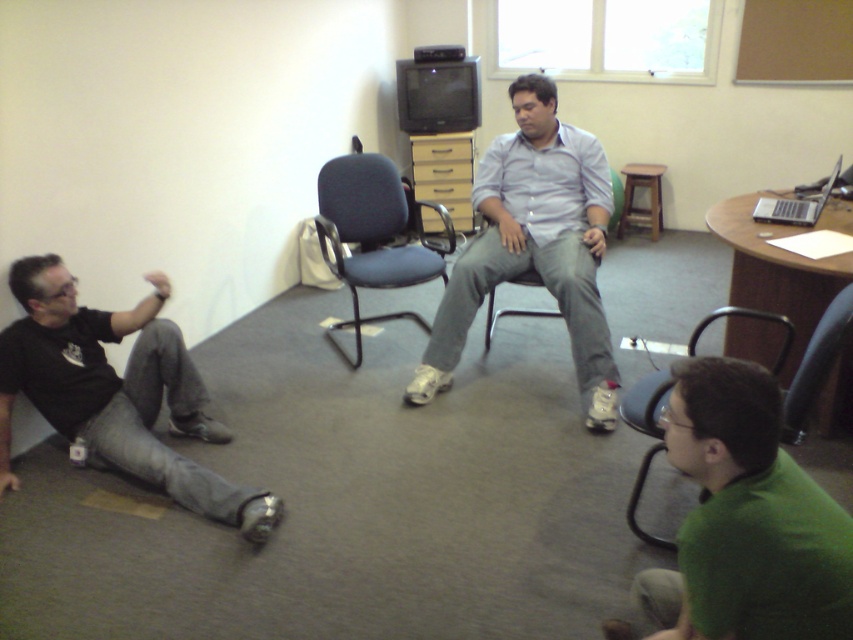
You are standing at the entrance of the room and want to greet the person in the black matte shirt at lower left and the person sitting on the matte blue chair at center. Which person should you approach first if you want to greet the one closer to the entrance?

The black matte shirt at lower left is to the left of the matte blue chair at center, so the black matte shirt at lower left is closer to the entrance. You should approach the black matte shirt at lower left first.

You are a delivery robot with a package that needs to be placed between the green matte shirt at lower right and the light blue shirt at center. The package requires a minimum of 1.6 meters of space. Is the distance sufficient?

The distance between the green matte shirt at lower right and the light blue shirt at center is 1.55 meters, which is less than the required 1.6 meters. Therefore, the space is insufficient for placing the package.

You are organizing a photo shoot and need to place two models wearing the green matte shirt at lower right and light blue shirt at center in a way that their clothing sizes are proportionate. Which model should you place in a position that requires a narrower silhouette?

The green matte shirt at lower right has a lesser width compared to the light blue shirt at center, so the model wearing the green matte shirt at lower right should be placed in the position requiring a narrower silhouette.